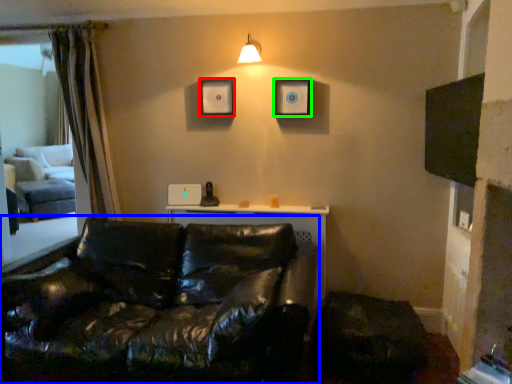
Question: Which is farther away from picture frame (highlighted by a red box)? studio couch (highlighted by a blue box) or picture frame (highlighted by a green box)?

Choices:
 (A) studio couch
 (B) picture frame

Answer: (A)